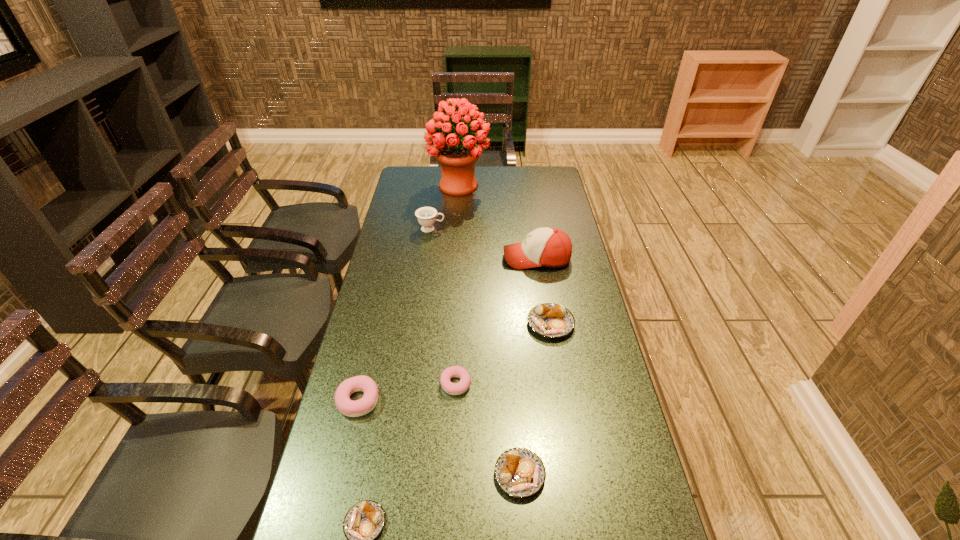
This screenshot has width=960, height=540. I want to click on the second farthest brown pastry, so click(x=519, y=472).

You are a GUI agent. You are given a task and a screenshot of the screen. Output one action in this format:
    pyautogui.click(x=<x>, y=<y>)
    Task: Click on the right pink pastry
    The height and width of the screenshot is (540, 960).
    Given the screenshot: What is the action you would take?
    pyautogui.click(x=462, y=386)

In order to click on the smaller pink pastry in this screenshot , I will do `click(462, 386)`.

What are the coordinates of `free space located on the left of the tallest object` in the screenshot? It's located at (411, 186).

This screenshot has width=960, height=540. In order to click on free space located on the front-facing side of the second tallest object in this screenshot , I will do `click(407, 258)`.

Find the location of a particular element. This screenshot has height=540, width=960. free spot located 0.290m on the front-facing side of the second tallest object is located at coordinates [425, 258].

Where is `vacant region located 0.370m on the front-facing side of the second tallest object`? The width and height of the screenshot is (960, 540). vacant region located 0.370m on the front-facing side of the second tallest object is located at coordinates (404, 258).

Locate an element on the screen. free space located 0.310m on the side of the teacup with the handle is located at coordinates pos(521,229).

This screenshot has height=540, width=960. Find the location of `vacant space located on the left of the farthest brown pastry`. vacant space located on the left of the farthest brown pastry is located at coordinates (448, 324).

Where is `free spot located on the right of the bigger pink pastry`? The height and width of the screenshot is (540, 960). free spot located on the right of the bigger pink pastry is located at coordinates (439, 400).